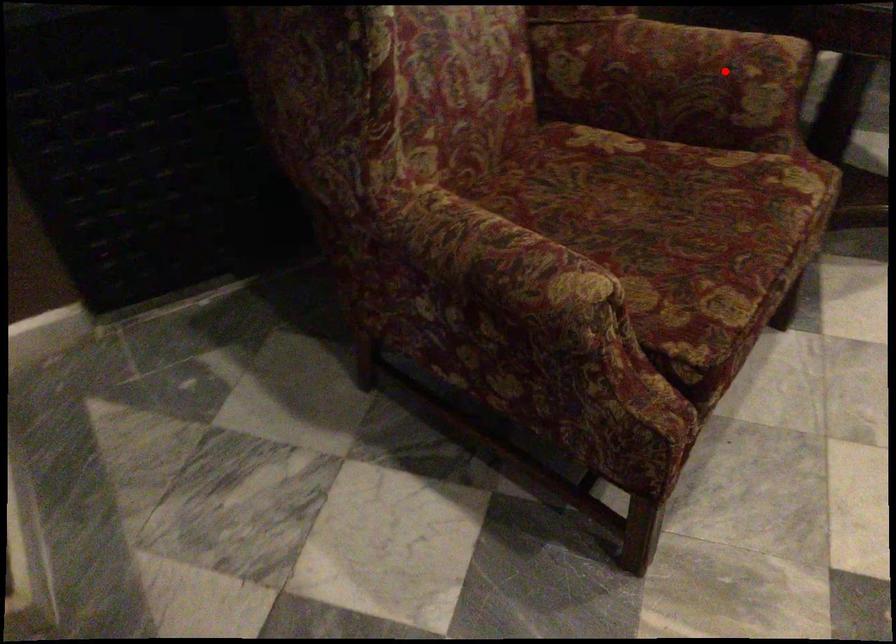
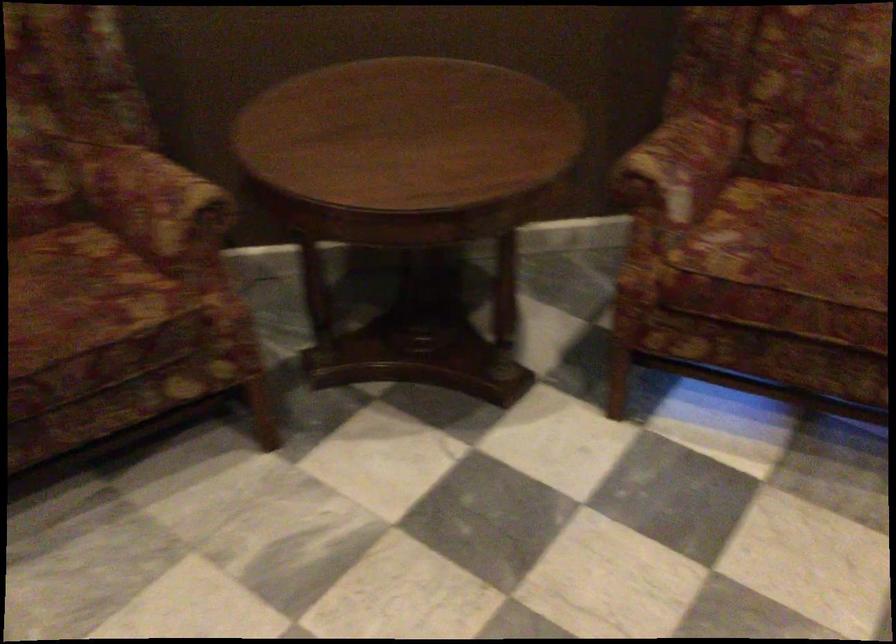
Question: I am providing you with two images of the same scene from different viewpoints. Given a red point in image1, look at the same physical point in image2. Is it:

Choices:
 (A) Closer to the viewpoint
 (B) Farther from the viewpoint

Answer: (B)